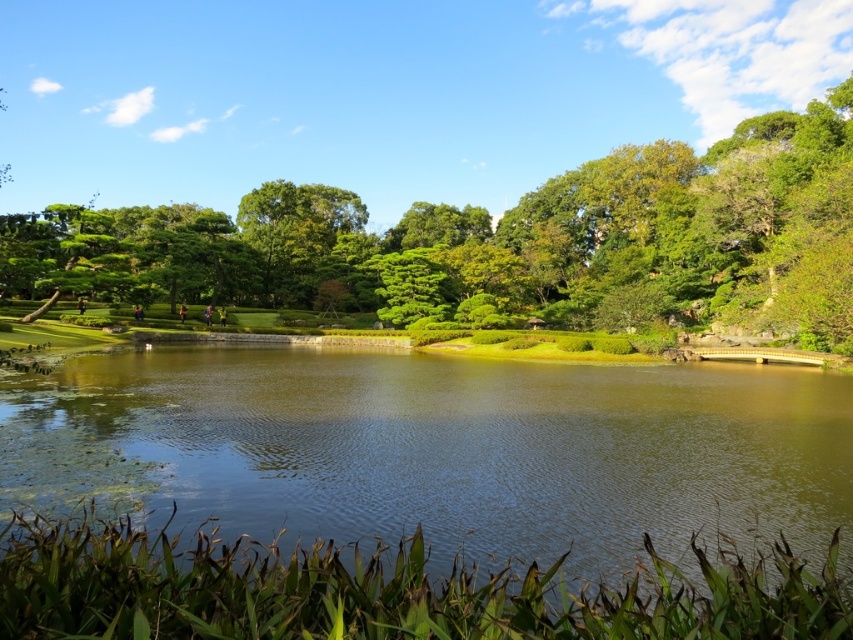
Question: Can you confirm if green grassy lake at center is positioned above green leafy tree at center?

Choices:
 (A) yes
 (B) no

Answer: (B)

Question: Which point is farther from the camera taking this photo?

Choices:
 (A) (683, 548)
 (B) (822, 136)

Answer: (B)

Question: Does green grassy lake at center appear over green leafy tree at center?

Choices:
 (A) no
 (B) yes

Answer: (A)

Question: Which object appears closest to the camera in this image?

Choices:
 (A) green grassy lake at center
 (B) green leafy tree at center

Answer: (A)

Question: Which object appears closest to the camera in this image?

Choices:
 (A) green leafy tree at center
 (B) green grassy lake at center

Answer: (B)

Question: Does green grassy lake at center come in front of green leafy tree at center?

Choices:
 (A) yes
 (B) no

Answer: (A)